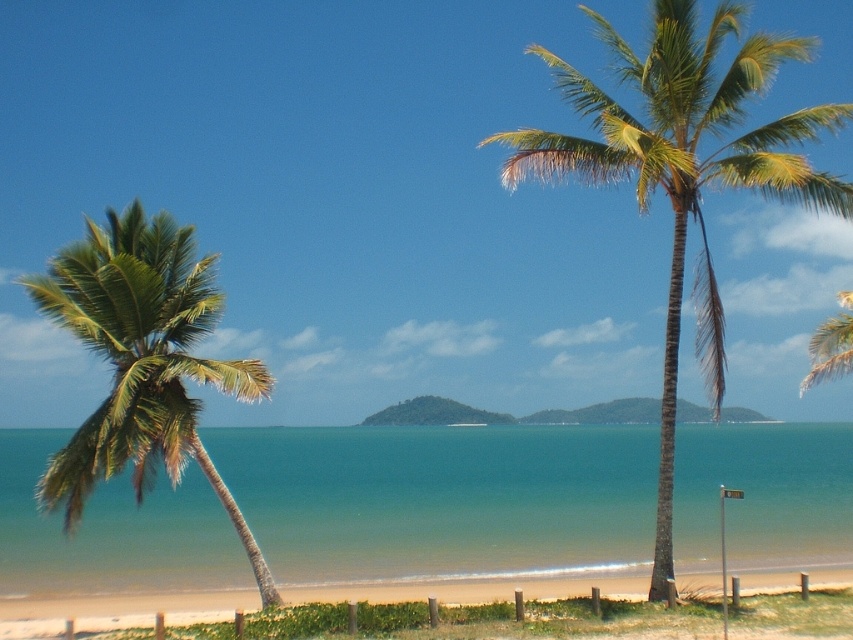
Who is positioned more to the left, green water at center or green leafy palm tree at center?

green water at center

Based on the photo, measure the distance between green water at center and camera.

A distance of 21.68 meters exists between green water at center and camera.

Is point (134, 506) positioned before point (724, 102)?

No, (134, 506) is further to viewer.

What are the coordinates of `green water at center` in the screenshot? It's located at (440, 497).

Is green leafy palm tree at left wider than green leafy palm tree at upper right?

No.

Is green leafy palm tree at left taller than green leafy palm tree at upper right?

Yes.

Who is more distant from viewer, (x=132, y=339) or (x=822, y=365)?

The point (x=822, y=365) is more distant.

The width and height of the screenshot is (853, 640). I want to click on green leafy palm tree at left, so click(142, 362).

Is point (791, 573) positioned after point (850, 324)?

Yes, point (791, 573) is behind point (850, 324).

Can you confirm if sandy beach at lower center is bigger than green leafy palm tree at upper right?

Incorrect, sandy beach at lower center is not larger than green leafy palm tree at upper right.

Where is `sandy beach at lower center`? sandy beach at lower center is located at coordinates (538, 600).